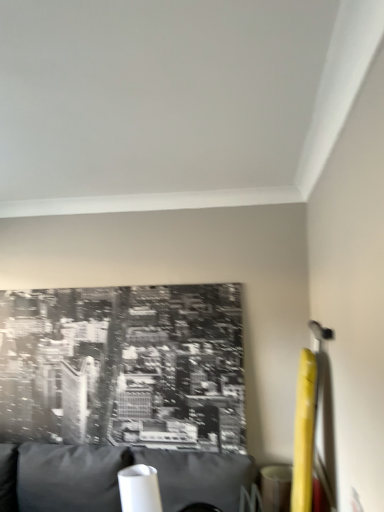
At what (x,y) coordinates should I click in order to perform the action: click on white glossy table lamp at lower center. Please return your answer as a coordinate pair (x, y). The width and height of the screenshot is (384, 512). Looking at the image, I should click on (139, 489).

Looking at this image, what is the approximate height of white glossy table lamp at lower center?

10.11 inches.

This screenshot has height=512, width=384. Describe the element at coordinates (139, 489) in the screenshot. I see `white glossy table lamp at lower center` at that location.

What is the approximate width of matte gray couch at lower left?

matte gray couch at lower left is 87.77 centimeters wide.

Describe the element at coordinates (115, 477) in the screenshot. I see `matte gray couch at lower left` at that location.

What are the coordinates of `matte gray couch at lower left` in the screenshot? It's located at pyautogui.click(x=115, y=477).

Locate an element on the screen. This screenshot has height=512, width=384. white glossy table lamp at lower center is located at coordinates (139, 489).

Based on their positions, is matte gray couch at lower left located to the left or right of white glossy table lamp at lower center?

Based on their positions, matte gray couch at lower left is located to the left of white glossy table lamp at lower center.

Between matte gray couch at lower left and white glossy table lamp at lower center, which one is positioned in front?

Positioned in front is matte gray couch at lower left.

Which is in front, point (214, 481) or point (130, 490)?

The point (130, 490) is more forward.

From the image's perspective, which one is positioned higher, matte gray couch at lower left or white glossy table lamp at lower center?

From the image's view, white glossy table lamp at lower center is above.

From a real-world perspective, is matte gray couch at lower left physically located above or below white glossy table lamp at lower center?

matte gray couch at lower left is situated lower than white glossy table lamp at lower center in the real world.

Does matte gray couch at lower left have a lesser width compared to white glossy table lamp at lower center?

Incorrect, the width of matte gray couch at lower left is not less than that of white glossy table lamp at lower center.

Considering the sizes of matte gray couch at lower left and white glossy table lamp at lower center in the image, is matte gray couch at lower left taller or shorter than white glossy table lamp at lower center?

In the image, matte gray couch at lower left appears to be taller than white glossy table lamp at lower center.

From the picture: Which of these two, matte gray couch at lower left or white glossy table lamp at lower center, is smaller?

Smaller between the two is white glossy table lamp at lower center.

Is matte gray couch at lower left inside the boundaries of white glossy table lamp at lower center, or outside?

matte gray couch at lower left is not enclosed by white glossy table lamp at lower center.

Is matte gray couch at lower left far away from white glossy table lamp at lower center?

No.

Consider the image. Is matte gray couch at lower left aimed at white glossy table lamp at lower center?

No, matte gray couch at lower left is not turned towards white glossy table lamp at lower center.

How many degrees apart are the facing directions of matte gray couch at lower left and white glossy table lamp at lower center?

matte gray couch at lower left and white glossy table lamp at lower center are facing 3.92 degrees away from each other.

I want to click on table lamp behind the matte gray couch at lower left, so [x=139, y=489].

Is white glossy table lamp at lower center to the left of matte gray couch at lower left from the viewer's perspective?

No.

Is the position of white glossy table lamp at lower center more distant than that of matte gray couch at lower left?

That is True.

Considering the points (136, 494) and (36, 489), which point is behind, point (136, 494) or point (36, 489)?

The point (36, 489) is behind.

From the image's perspective, which one is positioned higher, white glossy table lamp at lower center or matte gray couch at lower left?

From the image's view, white glossy table lamp at lower center is above.

From a real-world perspective, between white glossy table lamp at lower center and matte gray couch at lower left, who is vertically higher?

white glossy table lamp at lower center is physically above.

Which object is thinner, white glossy table lamp at lower center or matte gray couch at lower left?

With smaller width is white glossy table lamp at lower center.

From their relative heights in the image, would you say white glossy table lamp at lower center is taller or shorter than matte gray couch at lower left?

Considering their sizes, white glossy table lamp at lower center has less height than matte gray couch at lower left.

Does white glossy table lamp at lower center have a larger size compared to matte gray couch at lower left?

No, white glossy table lamp at lower center is not bigger than matte gray couch at lower left.

Is matte gray couch at lower left located within white glossy table lamp at lower center?

No, white glossy table lamp at lower center does not contain matte gray couch at lower left.

Is white glossy table lamp at lower center directly adjacent to matte gray couch at lower left?

No.

Is white glossy table lamp at lower center looking in the opposite direction of matte gray couch at lower left?

No, matte gray couch at lower left is not at the back of white glossy table lamp at lower center.

From the picture: How different are the orientations of white glossy table lamp at lower center and matte gray couch at lower left in degrees?

There is a 3.92-degree angle between the facing directions of white glossy table lamp at lower center and matte gray couch at lower left.

At what (x,y) coordinates should I click in order to perform the action: click on furniture in front of the white glossy table lamp at lower center. Please return your answer as a coordinate pair (x, y). Looking at the image, I should click on (115, 477).

This screenshot has height=512, width=384. In order to click on furniture to the left of white glossy table lamp at lower center in this screenshot , I will do `click(115, 477)`.

This screenshot has height=512, width=384. What are the coordinates of `table lamp above the matte gray couch at lower left (from a real-world perspective)` in the screenshot? It's located at (139, 489).